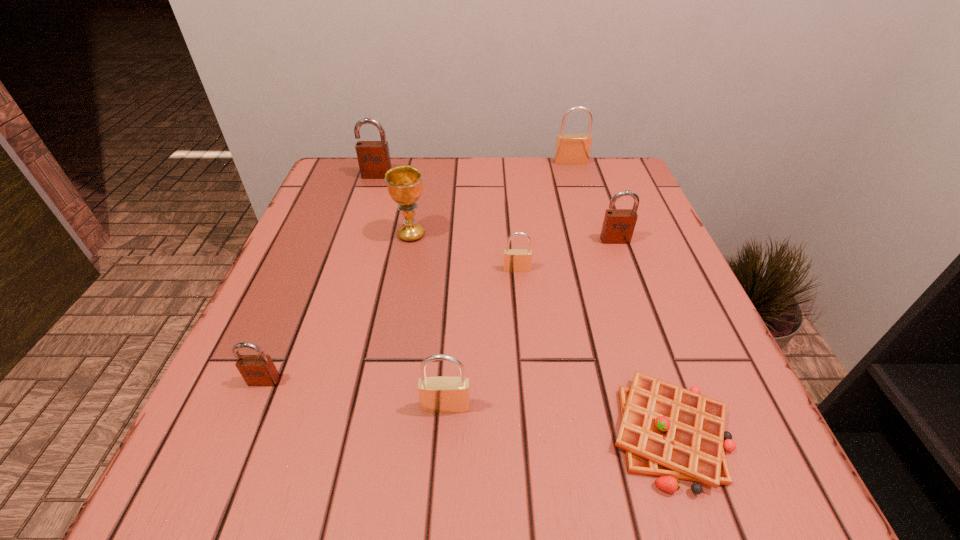
Where is `brass padlock that is the closest one to the second farthest brown padlock`? This screenshot has height=540, width=960. brass padlock that is the closest one to the second farthest brown padlock is located at coordinates (515, 260).

Where is `brass padlock object that ranks as the second closest to the fourth padlock from right to left`? Image resolution: width=960 pixels, height=540 pixels. brass padlock object that ranks as the second closest to the fourth padlock from right to left is located at coordinates (571, 149).

Choose which brown padlock is the nearest neighbor to the fourth nearest padlock. Please provide its 2D coordinates. Your answer should be formatted as a tuple, i.e. [(x, y)], where the tuple contains the x and y coordinates of a point satisfying the conditions above.

[(373, 157)]

Locate an element on the screen. the second closest brown padlock to the second nearest brown padlock is located at coordinates (257, 370).

Identify the location of free spot that satisfies the following two spatial constraints: 1. on the front-facing side of the shortest object; 2. on the left side of the nearest brown padlock. Image resolution: width=960 pixels, height=540 pixels. (242, 433).

Where is `vacant space that satisfies the following two spatial constraints: 1. on the front-facing side of the waffle; 2. on the left side of the leftmost brass padlock`? The width and height of the screenshot is (960, 540). vacant space that satisfies the following two spatial constraints: 1. on the front-facing side of the waffle; 2. on the left side of the leftmost brass padlock is located at coordinates (444, 433).